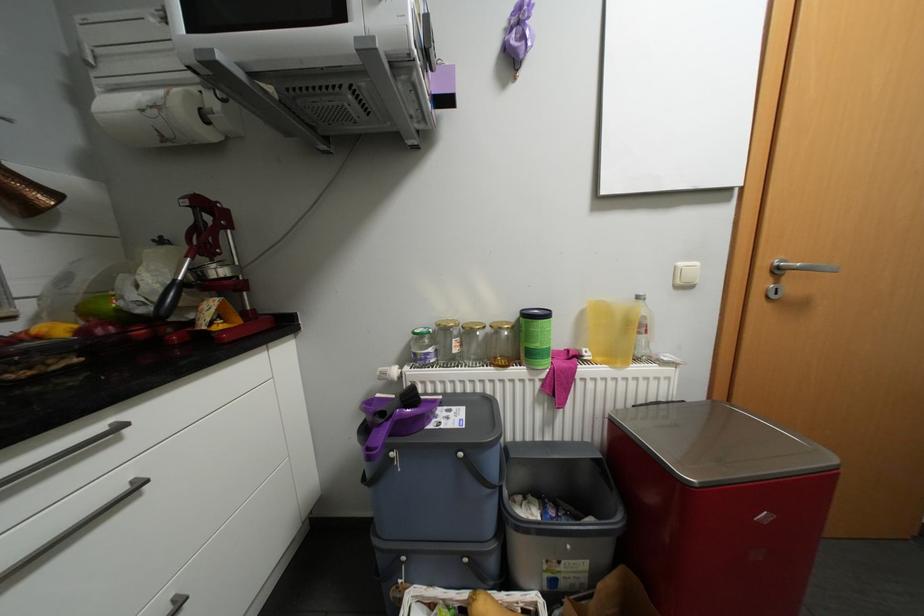
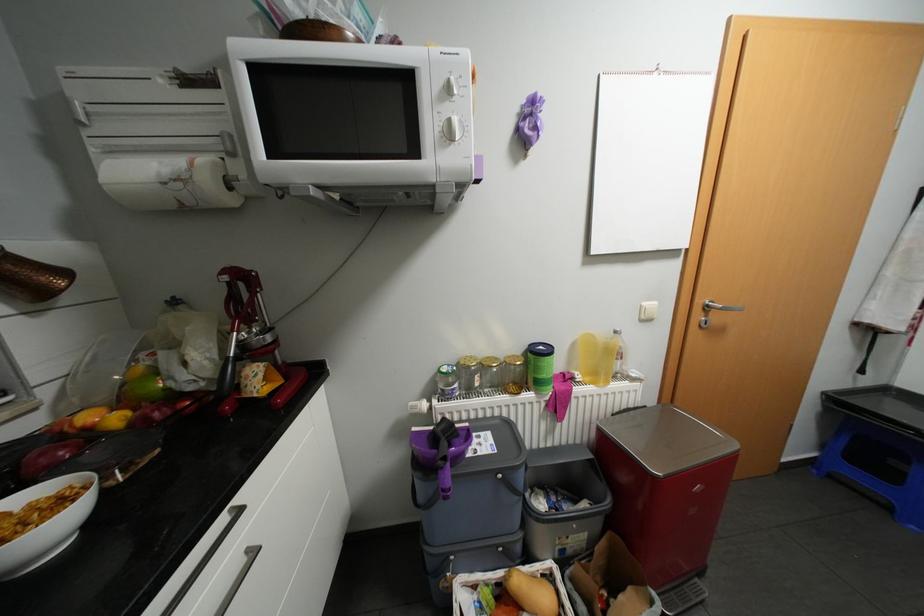
In the second image, find the point that corresponds to (215,217) in the first image.

(248, 284)